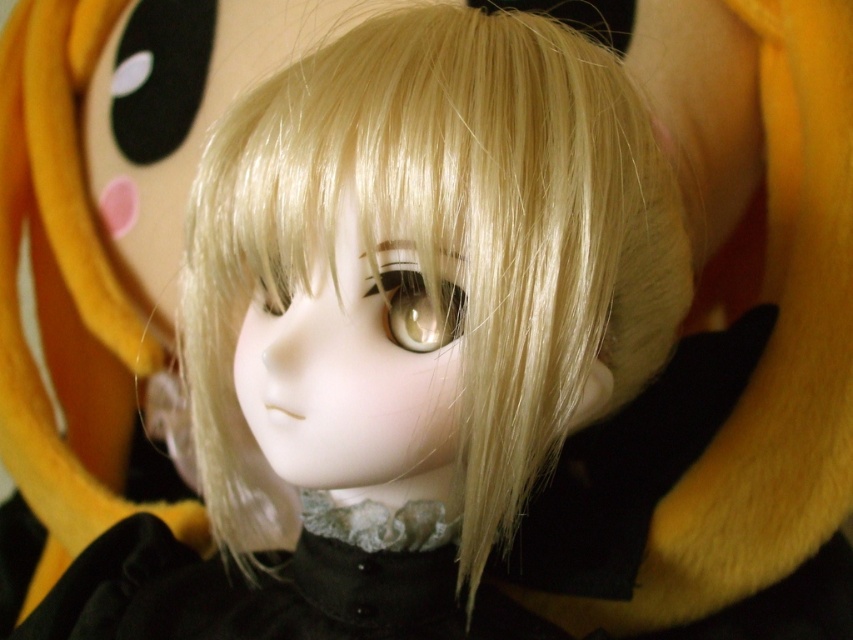
You are a photographer adjusting the focus on your camera. You want to capture both the blonde silky hair at center and the soft yellow plush at upper left in sharp detail. Which object should you focus on first to ensure both are in focus?

You should focus on the blonde silky hair at center first because it is closer to the viewer than the soft yellow plush at upper left. By focusing on the closer object, the depth of field may extend to include the background object as well.

You are a toy designer looking at the doll and want to create a new accessory that fits both the blonde silky hair at center and the soft yellow plush at upper left. Which object requires a smaller accessory size?

The blonde silky hair at center requires a smaller accessory size because it has a smaller size compared to the soft yellow plush at upper left.

You are a photographer setting up a close shot of the doll. The doll has blonde silky hair at center. Where should you position your camera to ensure the hair is centered in your frame?

The blonde silky hair at center is located at point (415, 312), so you should position your camera directly facing the center coordinates to ensure the hair is centered in your frame.